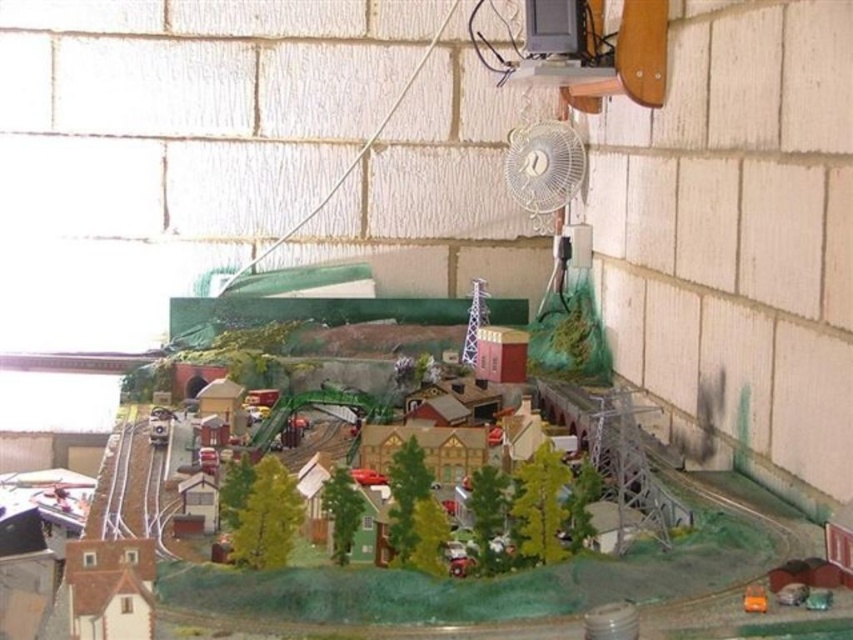
Can you confirm if white plastic fan at upper center is taller than orange matte toy at lower right?

Indeed, white plastic fan at upper center has a greater height compared to orange matte toy at lower right.

Between white plastic fan at upper center and orange matte toy at lower right, which one is positioned higher?

Positioned higher is white plastic fan at upper center.

Is point (569, 172) in front of point (752, 593)?

No, it is behind (752, 593).

Image resolution: width=853 pixels, height=640 pixels. I want to click on white plastic fan at upper center, so click(x=543, y=168).

Is white plastic fan at upper center wider than white plastic train track at lower left?

No, white plastic fan at upper center is not wider than white plastic train track at lower left.

Which is behind, point (532, 225) or point (120, 531)?

Point (532, 225)

The width and height of the screenshot is (853, 640). I want to click on white plastic fan at upper center, so click(x=543, y=168).

Is white plastic train track at lower left closer to the viewer compared to orange matte toy at lower right?

No, white plastic train track at lower left is behind orange matte toy at lower right.

Can you confirm if white plastic train track at lower left is bigger than orange matte toy at lower right?

Indeed, white plastic train track at lower left has a larger size compared to orange matte toy at lower right.

Which is behind, point (142, 465) or point (763, 595)?

Positioned behind is point (142, 465).

I want to click on white plastic train track at lower left, so click(135, 486).